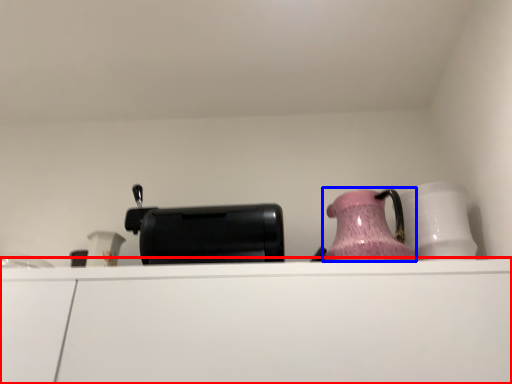
Question: Which point is further to the camera, cabinetry (highlighted by a red box) or jug (highlighted by a blue box)?

Choices:
 (A) cabinetry
 (B) jug

Answer: (B)